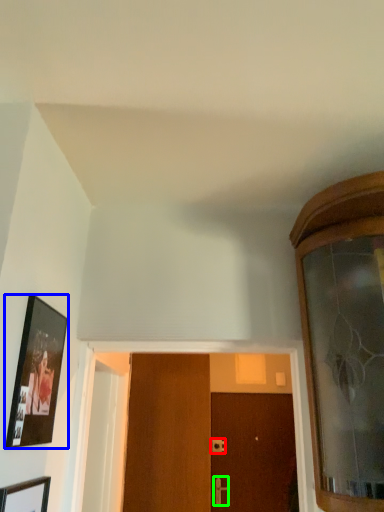
Question: Which is nearer to the door handle (highlighted by a red box)? picture frame (highlighted by a blue box) or door handle (highlighted by a green box).

Choices:
 (A) picture frame
 (B) door handle

Answer: (B)